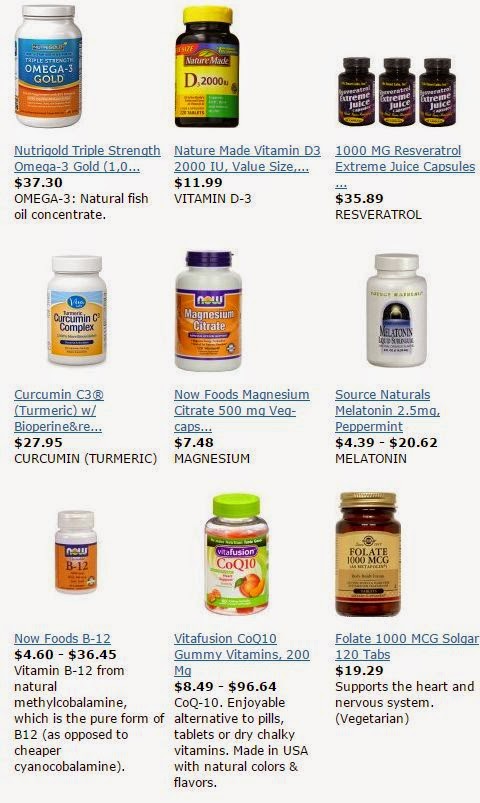
This screenshot has height=803, width=480. What are the coordinates of `dark glass jar` in the screenshot? It's located at (197, 35), (359, 516), (358, 75), (396, 75), (435, 78).